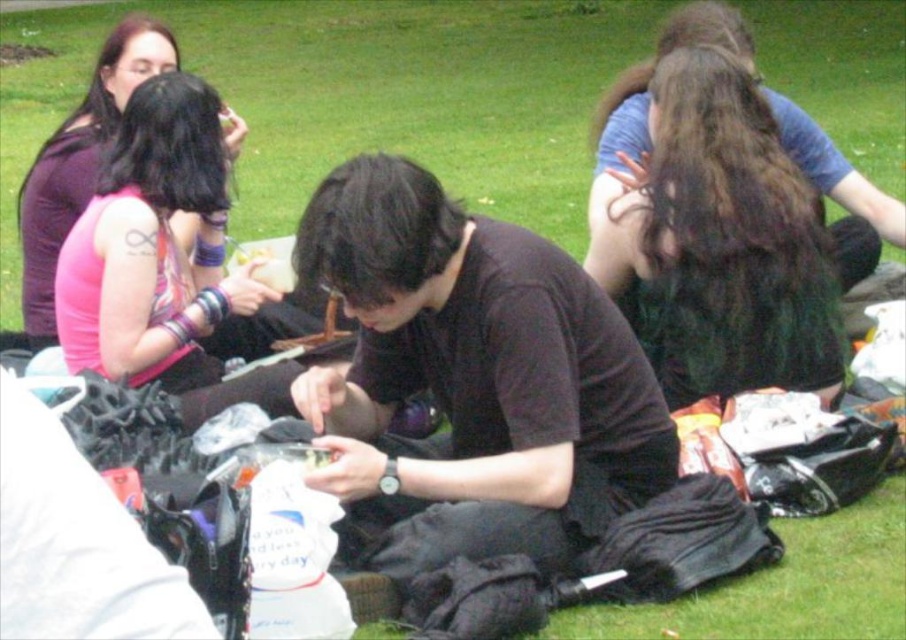
You are a photographer taking a picture of the dark brown hair at upper right and the pink fabric bracelet at upper left. Which object should you zoom in on to capture more details without moving the camera?

The dark brown hair at upper right is bigger than the pink fabric bracelet at upper left, so you should zoom in on the dark brown hair at upper right to capture more details without moving the camera since it is larger and occupies more space in the frame.

You are standing at point (x=766, y=240) and want to walk to point (x=359, y=243). Is the point you want to reach in front of you or behind you?

Point (x=359, y=243) is in front of point (x=766, y=240), so the point you want to reach is in front of you.